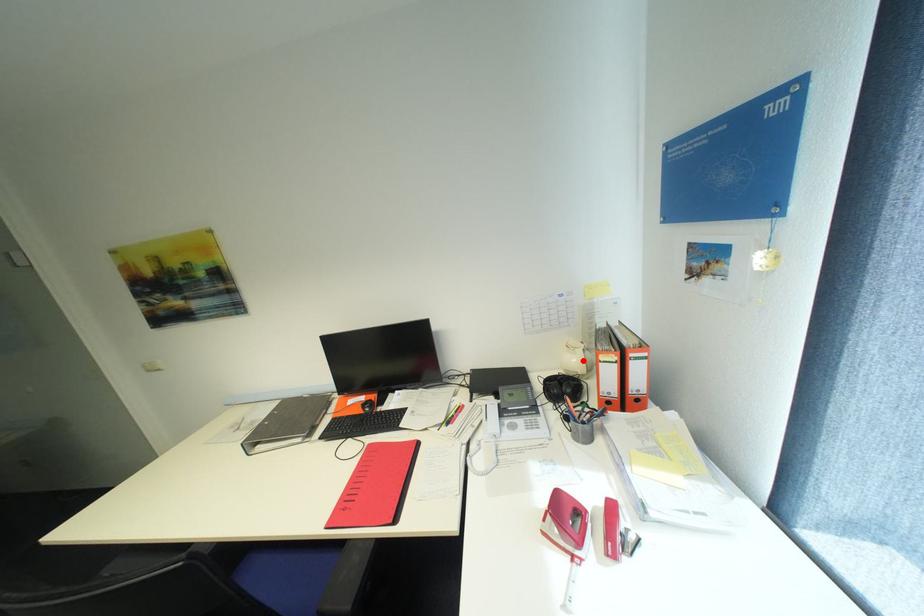
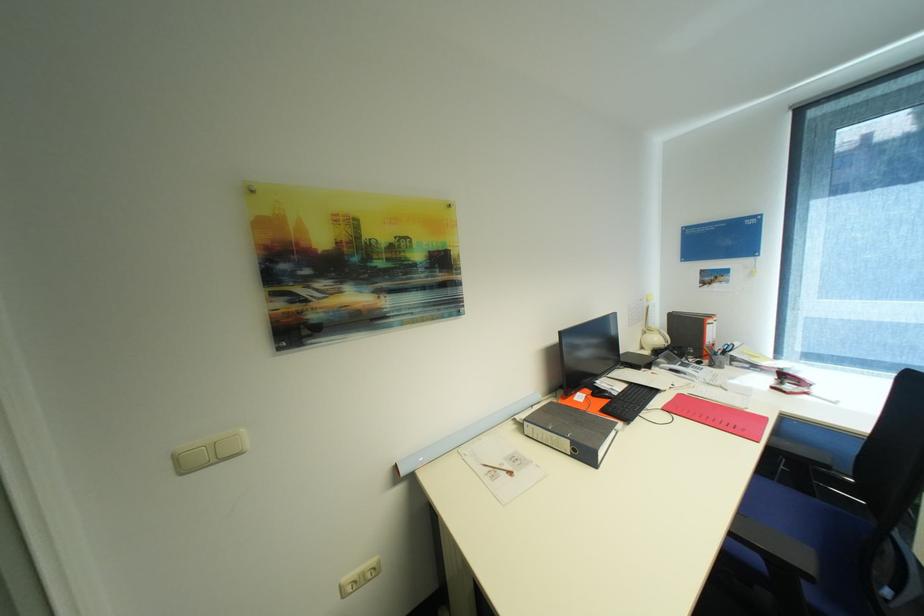
Find the pixel in the second image that matches the highlighted location in the first image.

(663, 339)